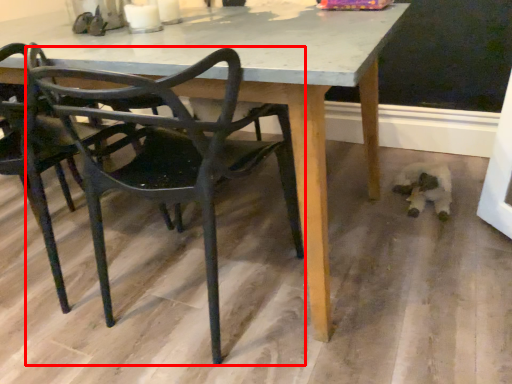
Question: From the image's perspective, considering the relative positions of chair (annotated by the red box) and chair in the image provided, where is chair (annotated by the red box) located with respect to the staircase?

Choices:
 (A) below
 (B) above

Answer: (A)